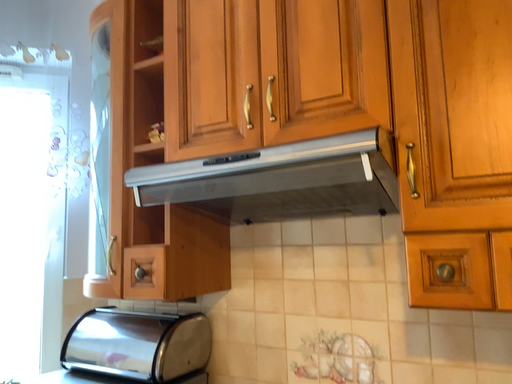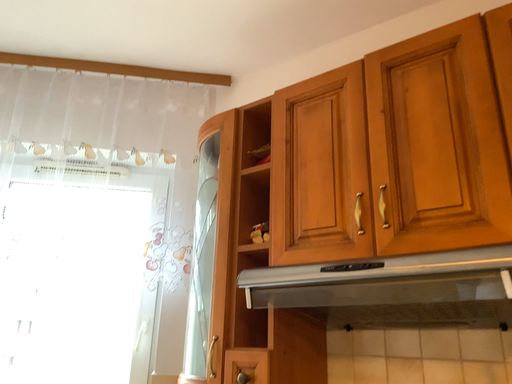
Question: Which way did the camera rotate in the video?

Choices:
 (A) rotated upward
 (B) rotated downward

Answer: (A)